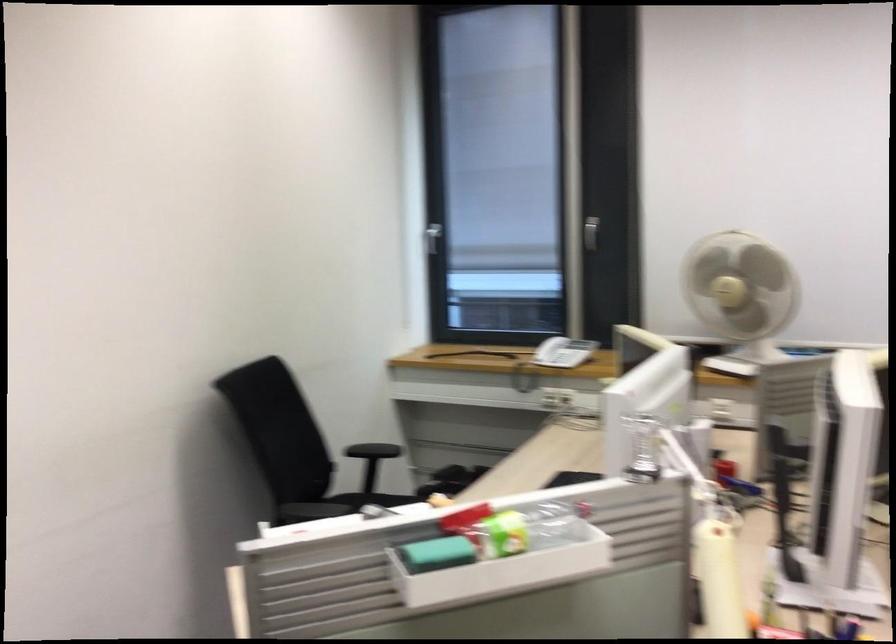
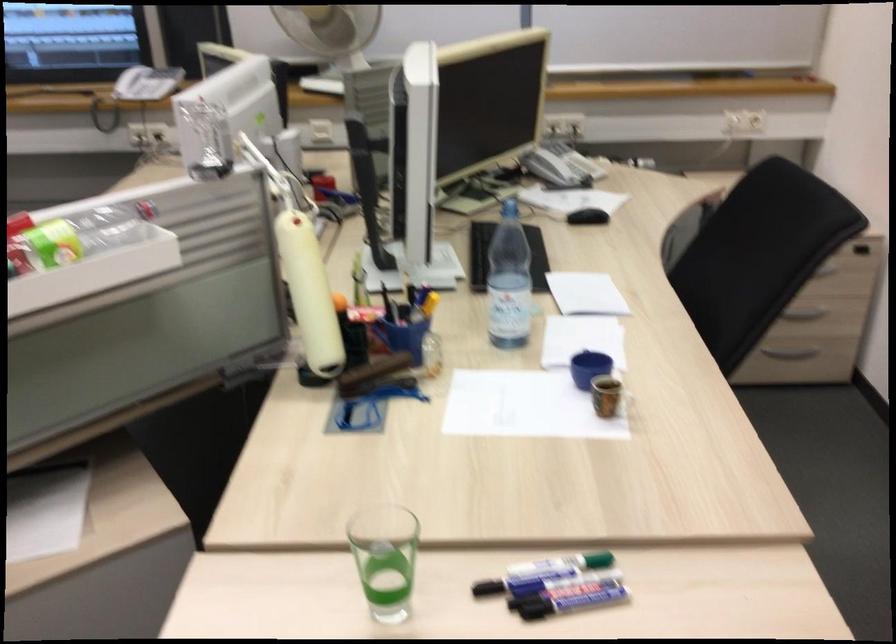
Question: Which direction would the cameraman need to move to produce the second image? Reply with the corresponding letter.

Choices:
 (A) Left
 (B) Right
 (C) Forward
 (D) Backward

Answer: (B)